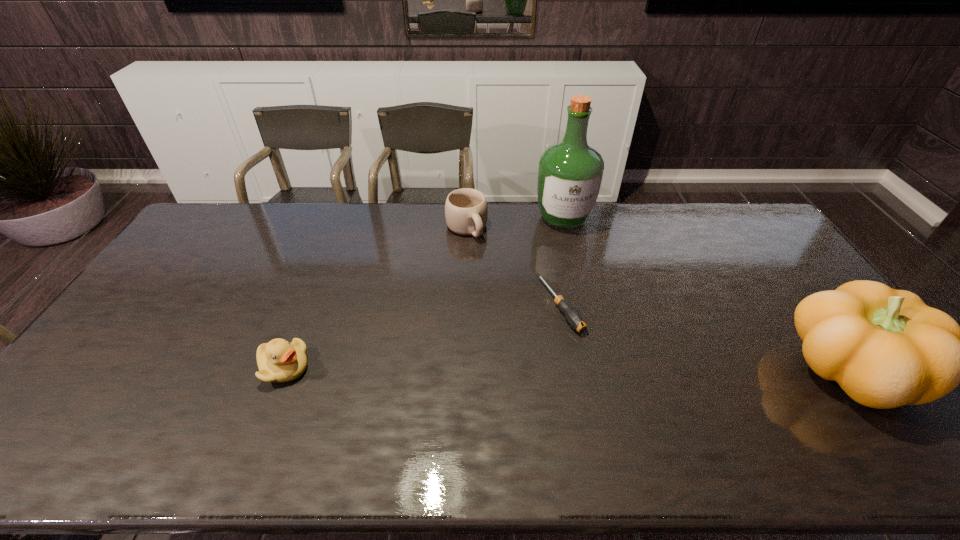
This screenshot has width=960, height=540. Identify the location of vacant space that is in between the mug and the duckling. (375, 298).

At what (x,y) coordinates should I click in order to perform the action: click on free space between the shortest object and the tallest object. Please return your answer as a coordinate pair (x, y). This screenshot has height=540, width=960. Looking at the image, I should click on (562, 262).

This screenshot has height=540, width=960. I want to click on vacant area between the liquor and the fourth object from right to left, so click(515, 223).

What are the coordinates of `empty space between the leftmost object and the mug` in the screenshot? It's located at (375, 298).

Find the location of `vacant space that's between the mug and the leftmost object`. vacant space that's between the mug and the leftmost object is located at coordinates (375, 298).

Identify the location of free space that is in between the second object from left to right and the tallest object. (515, 223).

Identify the location of vacant space that's between the fourth object from right to left and the leftmost object. The width and height of the screenshot is (960, 540). (375, 298).

In order to click on free spot between the tallest object and the second object from left to right in this screenshot , I will do `click(515, 223)`.

This screenshot has width=960, height=540. Identify the location of object that ranks as the second closest to the tallest object. (573, 317).

Identify which object is located as the third nearest to the second object from left to right. Please provide its 2D coordinates. Your answer should be formatted as a tuple, i.e. [(x, y)], where the tuple contains the x and y coordinates of a point satisfying the conditions above.

[(278, 360)]